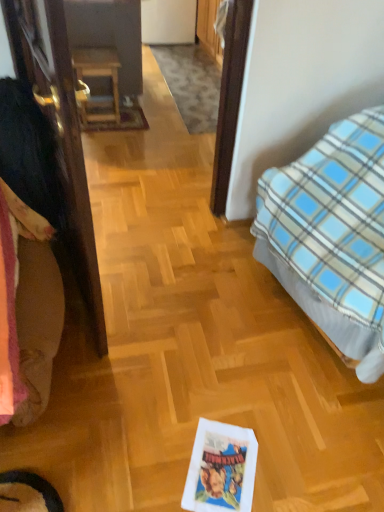
Locate an element on the screen. The image size is (384, 512). vacant area situated below fluffy beige blanket at left (from a real-world perspective) is located at coordinates (66, 368).